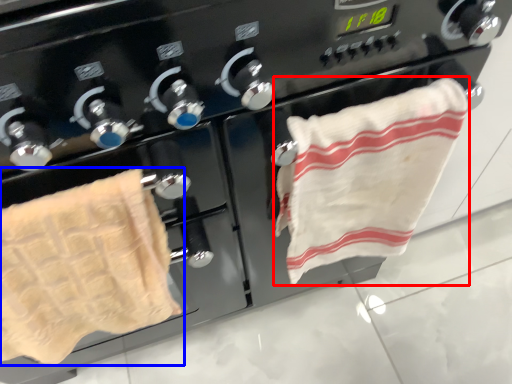
Question: Which object is closer to the camera taking this photo, towel (highlighted by a red box) or towel (highlighted by a blue box)?

Choices:
 (A) towel
 (B) towel

Answer: (B)